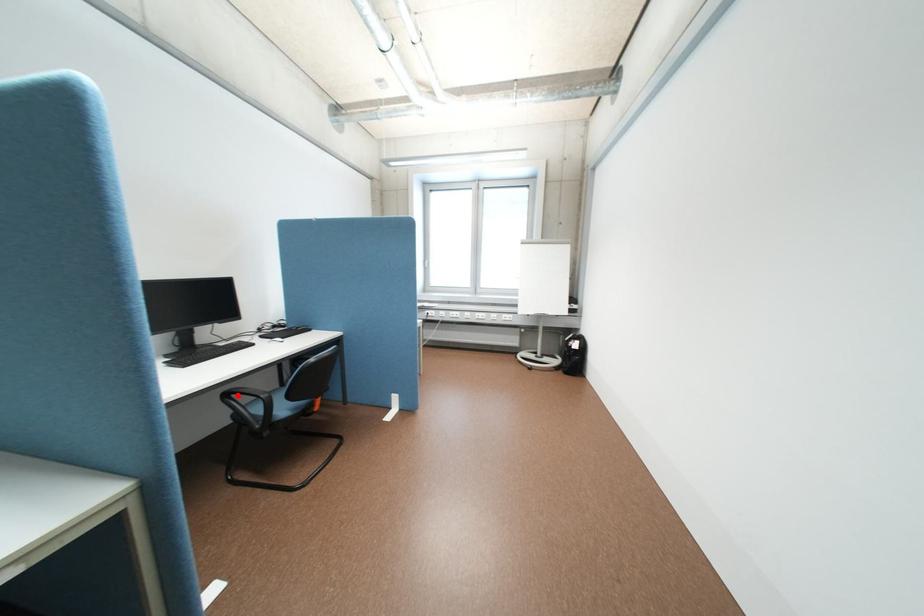
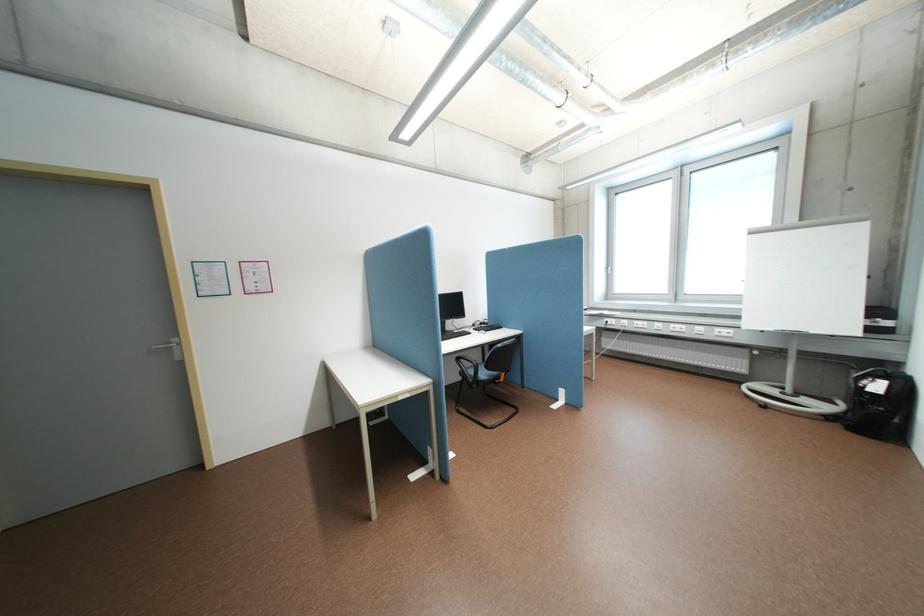
In the second image, find the point that corresponds to the highlighted location in the first image.

(468, 359)